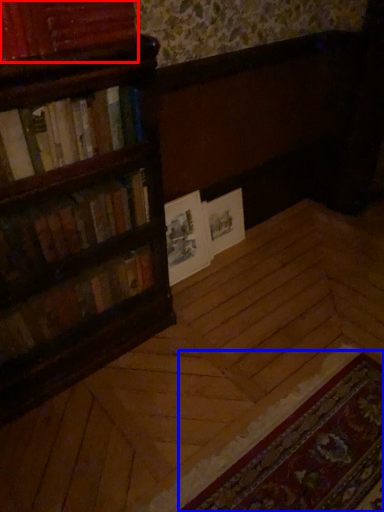
Question: Which object appears farthest to the camera in this image, book (highlighted by a red box) or mat (highlighted by a blue box)?

Choices:
 (A) book
 (B) mat

Answer: (A)